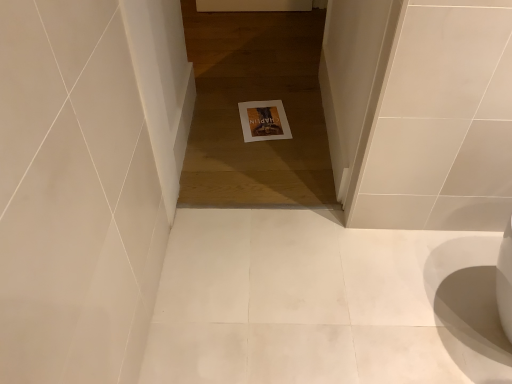
Identify the location of vacant point above white paper at center (from a real-world perspective). Image resolution: width=512 pixels, height=384 pixels. (261, 115).